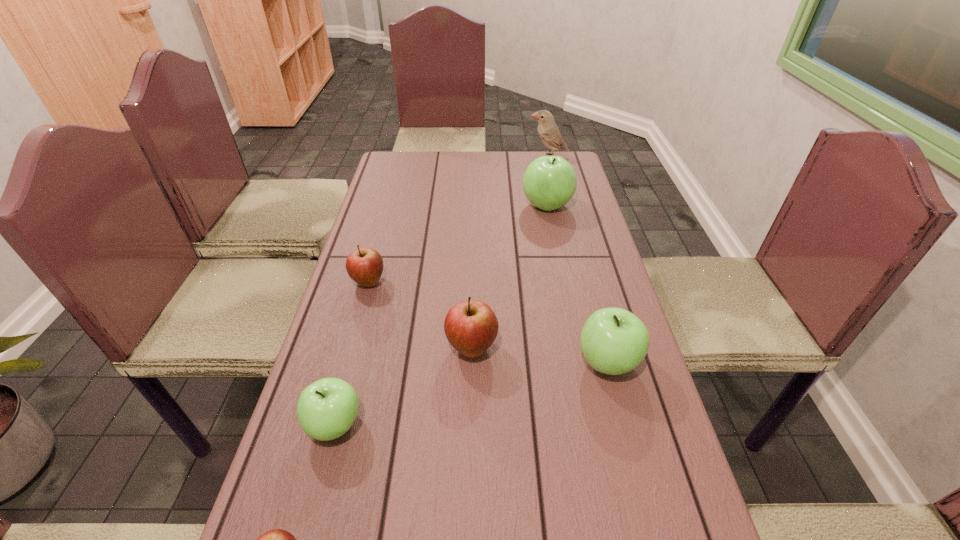
At what (x,y) coordinates should I click in order to perform the action: click on vacant space that satisfies the following two spatial constraints: 1. at the face of the farthest object; 2. on the front side of the leftmost green apple. Please return your answer as a coordinate pair (x, y). Looking at the image, I should click on (613, 425).